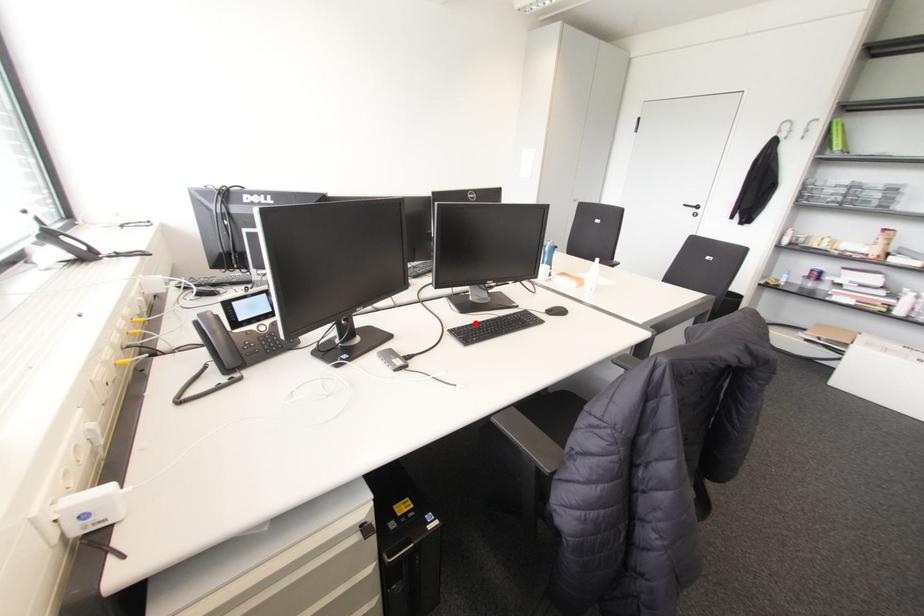
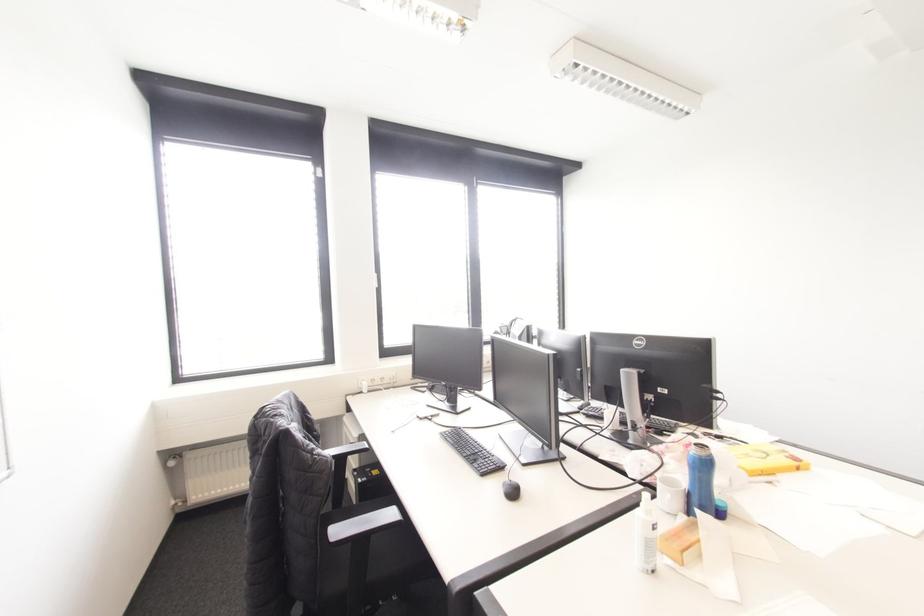
Where in the second image is the point corresponding to the highlighted location from the first image?

(468, 436)